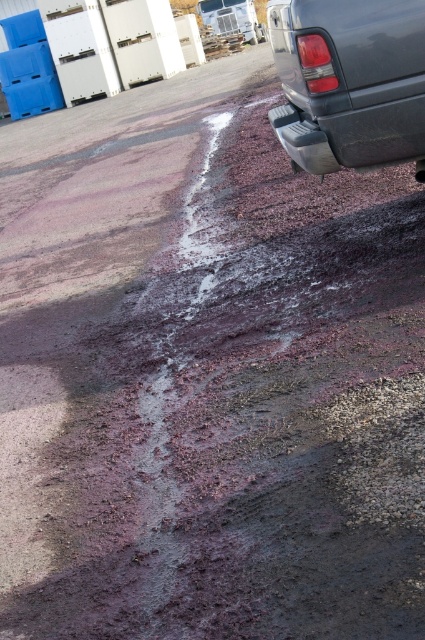
You are a delivery person who needs to park your vehicle near the glossy plastic truck at upper right and the black rubber tire at lower right. Based on their positions, which object should you park closer to if you want to be nearest to the one that is higher up?

The black rubber tire at lower right is higher up than the glossy plastic truck at upper right, so you should park closer to the black rubber tire at lower right to be nearest to the higher object.

Where is the glossy plastic truck at upper right located in the image?

The glossy plastic truck at upper right is located at point (350,81) in the image.

You are a delivery driver who just arrived at the parking lot. You see the spill and need to avoid it. The truck you came in is located at point [232,17]. Can you safely drive your truck away from the spill without going near it?

Point [232,17] marks brushed metal truck at upper right, so the truck is located at the upper right corner of the parking lot. Since the spill is in the center area, you can drive the truck away by moving towards the upper right direction, away from the spill.